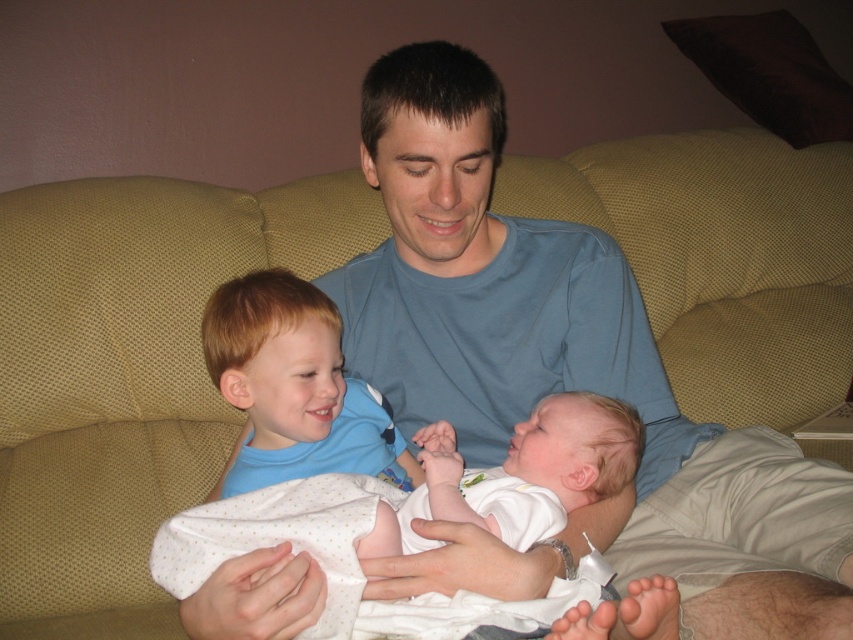
Does white soft fabric baby at center have a greater width compared to blue cotton shirt at center?

Yes, white soft fabric baby at center is wider than blue cotton shirt at center.

Does point (582, 440) come farther from viewer compared to point (415, 472)?

No, (582, 440) is closer to viewer.

Locate an element on the screen. This screenshot has height=640, width=853. white soft fabric baby at center is located at coordinates (416, 500).